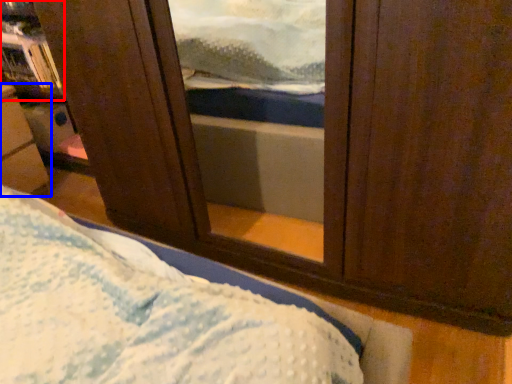
Question: Which of the following is the closest to the observer, bookshelf (highlighted by a red box) or furniture (highlighted by a blue box)?

Choices:
 (A) bookshelf
 (B) furniture

Answer: (B)